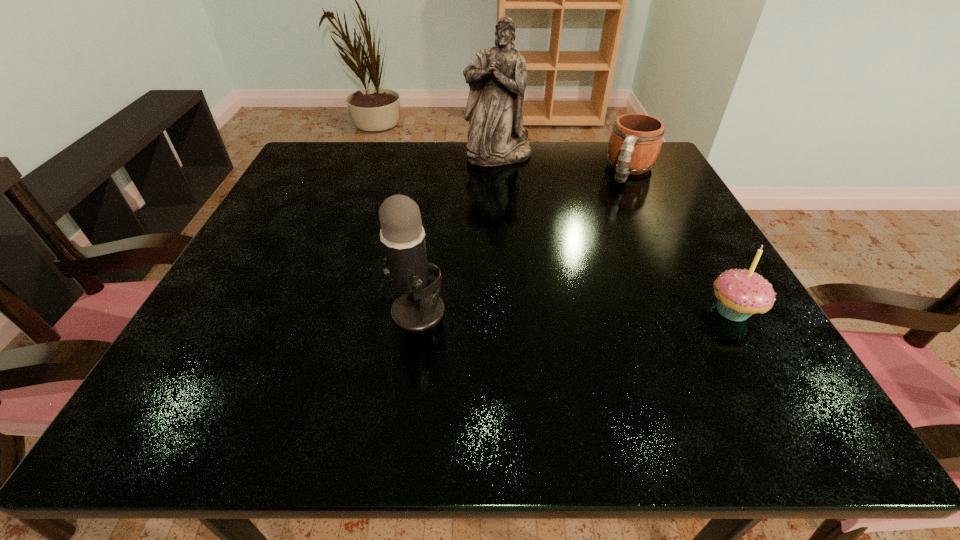
I want to click on object positioned at the far right corner, so click(x=636, y=139).

Find the location of `object present at the near right corner`. object present at the near right corner is located at coordinates (740, 293).

At what (x,y) coordinates should I click in order to perform the action: click on vacant space at the far edge of the desktop. Please return your answer as a coordinate pair (x, y). This screenshot has width=960, height=540. Looking at the image, I should click on (545, 146).

Where is `vacant space at the near edge of the desktop`? The image size is (960, 540). vacant space at the near edge of the desktop is located at coordinates (581, 332).

In the image, there is a desktop. Identify the location of free space at the left edge. (300, 204).

The image size is (960, 540). I want to click on vacant area at the right edge of the desktop, so (x=646, y=260).

At what (x,y) coordinates should I click in order to perform the action: click on free spot at the far left corner of the desktop. Please return your answer as a coordinate pair (x, y). The width and height of the screenshot is (960, 540). Looking at the image, I should click on (320, 168).

This screenshot has height=540, width=960. In order to click on vacant region at the far right corner of the desktop in this screenshot , I will do `click(650, 171)`.

The height and width of the screenshot is (540, 960). In the image, there is a desktop. In order to click on vacant space at the near right corner in this screenshot , I will do `click(690, 339)`.

Locate an element on the screen. The width and height of the screenshot is (960, 540). vacant area that lies between the third object from right to left and the mug is located at coordinates [x=564, y=163].